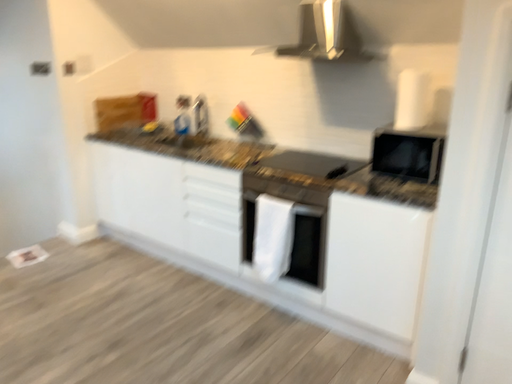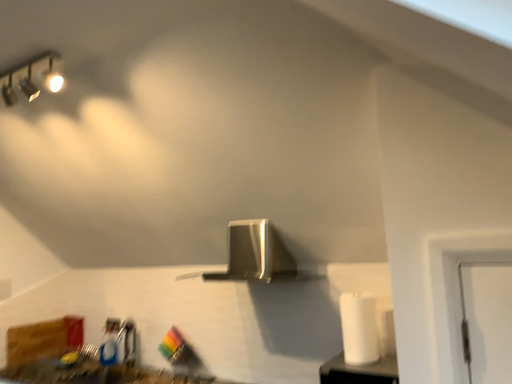
Question: Which way did the camera rotate in the video?

Choices:
 (A) rotated upward
 (B) rotated downward

Answer: (A)